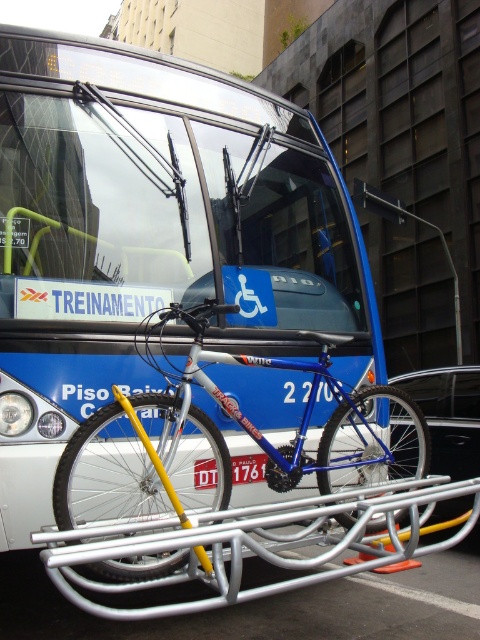
Can you confirm if blue matte bus at center is positioned above silver metallic bike rack at center?

Indeed, blue matte bus at center is positioned over silver metallic bike rack at center.

Find the location of `blue matte bus at center`. blue matte bus at center is located at coordinates point(153,236).

Which is behind, point (238, 273) or point (282, 525)?

The point (238, 273) is behind.

Locate an element on the screen. This screenshot has width=480, height=640. blue matte bus at center is located at coordinates (153, 236).

How distant is blue matte bus at center from blue metallic bicycle at center?

The distance of blue matte bus at center from blue metallic bicycle at center is 54.19 centimeters.

Who is shorter, blue matte bus at center or blue metallic bicycle at center?

blue metallic bicycle at center

This screenshot has height=640, width=480. What do you see at coordinates (153, 236) in the screenshot?
I see `blue matte bus at center` at bounding box center [153, 236].

Find the location of `blue matte bus at center`. blue matte bus at center is located at coordinates (153, 236).

Can you confirm if blue metallic bicycle at center is positioned above silver metallic bike rack at center?

Indeed, blue metallic bicycle at center is positioned over silver metallic bike rack at center.

Which is more to the left, blue metallic bicycle at center or silver metallic bike rack at center?

Positioned to the left is silver metallic bike rack at center.

Which is behind, point (384, 449) or point (148, 548)?

The point (384, 449) is behind.

The width and height of the screenshot is (480, 640). What are the coordinates of `blue metallic bicycle at center` in the screenshot? It's located at (225, 442).